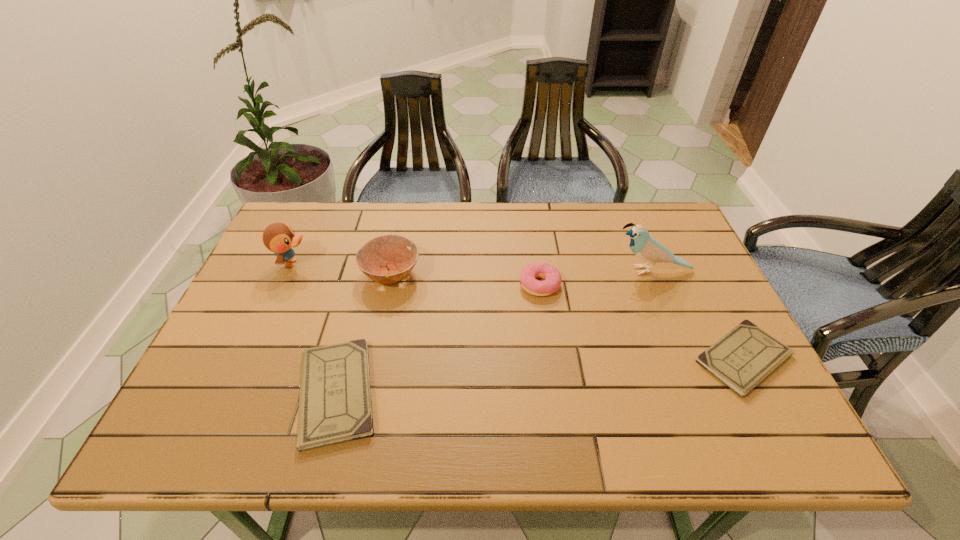
At what (x,y) coordinates should I click in order to perform the action: click on the left checkbook. Please return your answer as a coordinate pair (x, y). Looking at the image, I should click on (335, 406).

Locate an element on the screen. the taller checkbook is located at coordinates (335, 406).

Locate an element on the screen. The height and width of the screenshot is (540, 960). the shorter checkbook is located at coordinates (744, 357).

Image resolution: width=960 pixels, height=540 pixels. In order to click on the right checkbook in this screenshot , I will do `click(744, 357)`.

Find the location of a particular element. Image resolution: width=960 pixels, height=540 pixels. the third shortest object is located at coordinates (552, 278).

Locate an element on the screen. the fourth object from left to right is located at coordinates (552, 278).

Identify the location of the tallest object. The width and height of the screenshot is (960, 540). (647, 248).

Find the location of a particular element. The width and height of the screenshot is (960, 540). bowl is located at coordinates (386, 259).

In order to click on duck in this screenshot , I will do `click(279, 238)`.

I want to click on the second tallest object, so click(x=279, y=238).